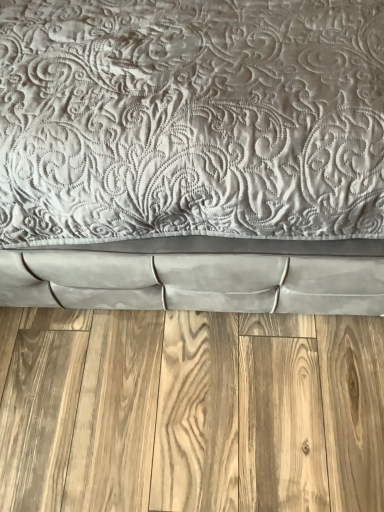
Question: From the image's perspective, would you say satin gray quilted bed at center is positioned over natural wood flooring at bottom?

Choices:
 (A) yes
 (B) no

Answer: (A)

Question: Does satin gray quilted bed at center have a greater height compared to natural wood flooring at bottom?

Choices:
 (A) yes
 (B) no

Answer: (A)

Question: From a real-world perspective, is satin gray quilted bed at center beneath natural wood flooring at bottom?

Choices:
 (A) no
 (B) yes

Answer: (A)

Question: Is satin gray quilted bed at center facing away from natural wood flooring at bottom?

Choices:
 (A) no
 (B) yes

Answer: (A)

Question: Are satin gray quilted bed at center and natural wood flooring at bottom beside each other?

Choices:
 (A) no
 (B) yes

Answer: (A)

Question: Is satin gray quilted bed at center at the left side of natural wood flooring at bottom?

Choices:
 (A) no
 (B) yes

Answer: (A)

Question: Is natural wood flooring at bottom bigger than satin gray quilted bed at center?

Choices:
 (A) yes
 (B) no

Answer: (B)

Question: Does natural wood flooring at bottom have a smaller size compared to satin gray quilted bed at center?

Choices:
 (A) no
 (B) yes

Answer: (B)

Question: From a real-world perspective, is natural wood flooring at bottom under satin gray quilted bed at center?

Choices:
 (A) no
 (B) yes

Answer: (B)

Question: Is the surface of natural wood flooring at bottom in direct contact with satin gray quilted bed at center?

Choices:
 (A) yes
 (B) no

Answer: (B)

Question: Is natural wood flooring at bottom completely or partially outside of satin gray quilted bed at center?

Choices:
 (A) no
 (B) yes

Answer: (B)

Question: Is natural wood flooring at bottom surrounding satin gray quilted bed at center?

Choices:
 (A) no
 (B) yes

Answer: (A)

Question: Is satin gray quilted bed at center bigger or smaller than natural wood flooring at bottom?

Choices:
 (A) small
 (B) big

Answer: (B)